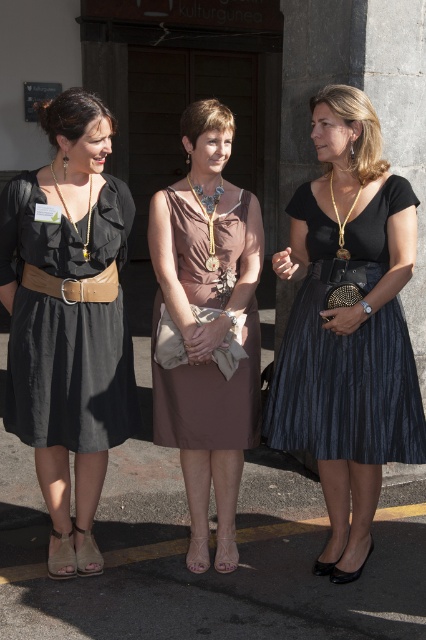
Question: Which of the following is the farthest from the observer?

Choices:
 (A) (239, 262)
 (B) (360, 250)
 (C) (89, 264)

Answer: (A)

Question: Is shiny black skirt at center to the right of matte brown dress at center from the viewer's perspective?

Choices:
 (A) yes
 (B) no

Answer: (A)

Question: Does shiny black skirt at center appear over matte brown dress at center?

Choices:
 (A) yes
 (B) no

Answer: (B)

Question: Among these objects, which one is nearest to the camera?

Choices:
 (A) matte black dress at left
 (B) shiny black skirt at center

Answer: (B)

Question: Which point is farther from the camera taking this photo?

Choices:
 (A) (399, 241)
 (B) (77, 451)

Answer: (B)

Question: Does matte black dress at left appear under brown leather belt at center?

Choices:
 (A) yes
 (B) no

Answer: (A)